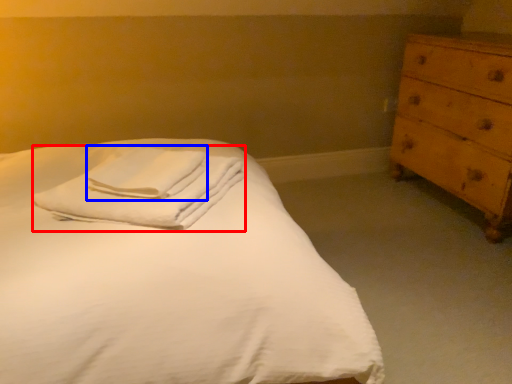
Question: Which of the following is the closest to the observer, material (highlighted by a red box) or bath towel (highlighted by a blue box)?

Choices:
 (A) material
 (B) bath towel

Answer: (A)